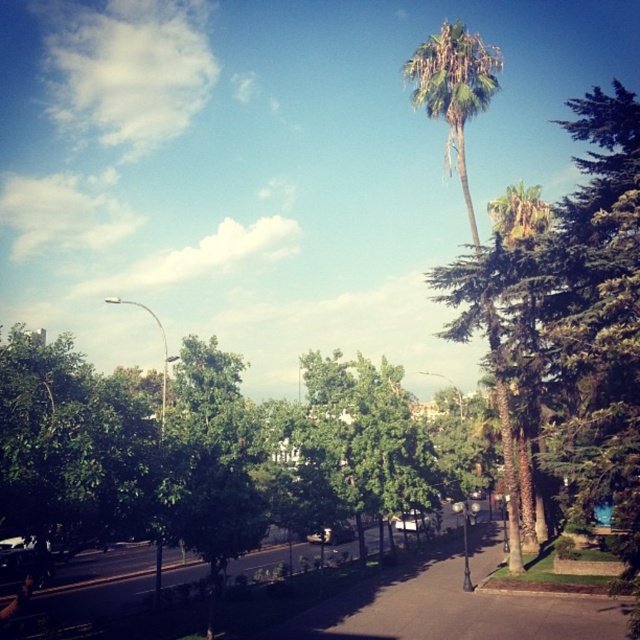
You are a pedestrian standing on the paved pathway in the urban park scene. You see the green leafy tree at upper right and the green leafy palm tree at center. Which tree is positioned more to the east if the sun is setting in the west?

The green leafy palm tree at center is positioned more to the east because the green leafy tree at upper right is to the right of it, and since the sun is setting in the west, shadows would point eastward. If the palm tree is to the left of the other tree, it would be closer to the east direction.

You are a park visitor trying to decide where to rest. You see the green leafy tree at upper right and the green leafy palm tree at center. Which tree offers more shade coverage for sitting underneath?

The green leafy tree at upper right might be wider than the green leafy palm tree at center, so it likely provides more shade coverage for sitting underneath.

You are a photographer standing on the paved pathway and want to take a photo that includes both the green leafy tree at upper right and the green leafy palm tree at center. Which tree should you position closer to the front of your camera frame to ensure both are in focus?

You should position the green leafy tree at upper right closer to the front of your camera frame because it is closer to the viewer than the green leafy palm tree at center. This way, both will be in focus as the camera can maintain focus on objects at varying distances when the closer one is at the front.